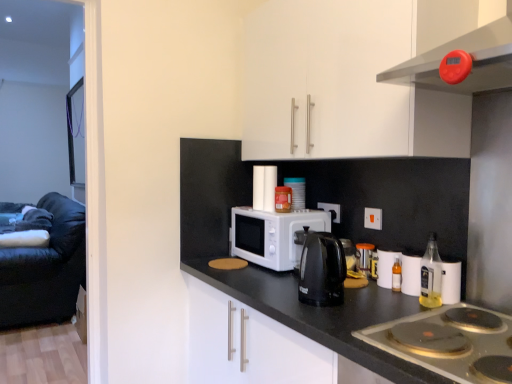
You are a GUI agent. You are given a task and a screenshot of the screen. Output one action in this format:
    pyautogui.click(x=<x>, y=<y>)
    Task: Click on the vacant space in front of black plastic kettle at center
    The height and width of the screenshot is (384, 512).
    Given the screenshot: What is the action you would take?
    pyautogui.click(x=316, y=319)